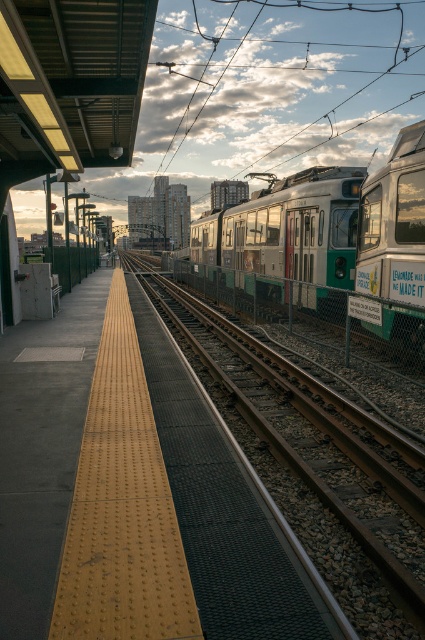
Question: Is metal/textured track at center behind green metallic train at center?

Choices:
 (A) no
 (B) yes

Answer: (A)

Question: Which object is farther from the camera taking this photo?

Choices:
 (A) green metallic train at center
 (B) silver metallic train at center
 (C) green metallic train at right
 (D) metal/textured track at center

Answer: (B)

Question: Which object is positioned closest to the metal/textured track at center?

Choices:
 (A) silver metallic train at center
 (B) green metallic train at right

Answer: (A)

Question: Does metal/textured track at center have a lesser width compared to green metallic train at center?

Choices:
 (A) no
 (B) yes

Answer: (B)

Question: Which object is positioned closest to the green metallic train at center?

Choices:
 (A) metal/textured track at center
 (B) green metallic train at right

Answer: (A)

Question: Is the position of green metallic train at center more distant than that of silver metallic train at center?

Choices:
 (A) no
 (B) yes

Answer: (A)